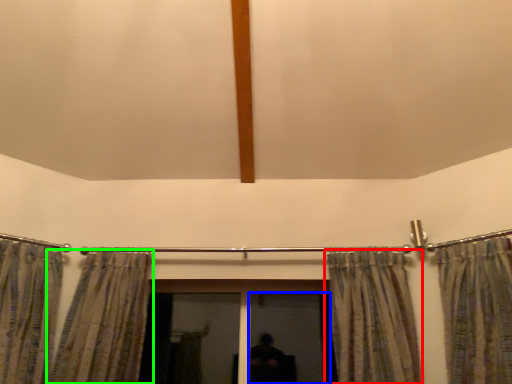
Question: Estimate the real-world distances between objects in this image. Which object is closer to curtain (highlighted by a red box), screen door (highlighted by a blue box) or curtain (highlighted by a green box)?

Choices:
 (A) screen door
 (B) curtain

Answer: (A)